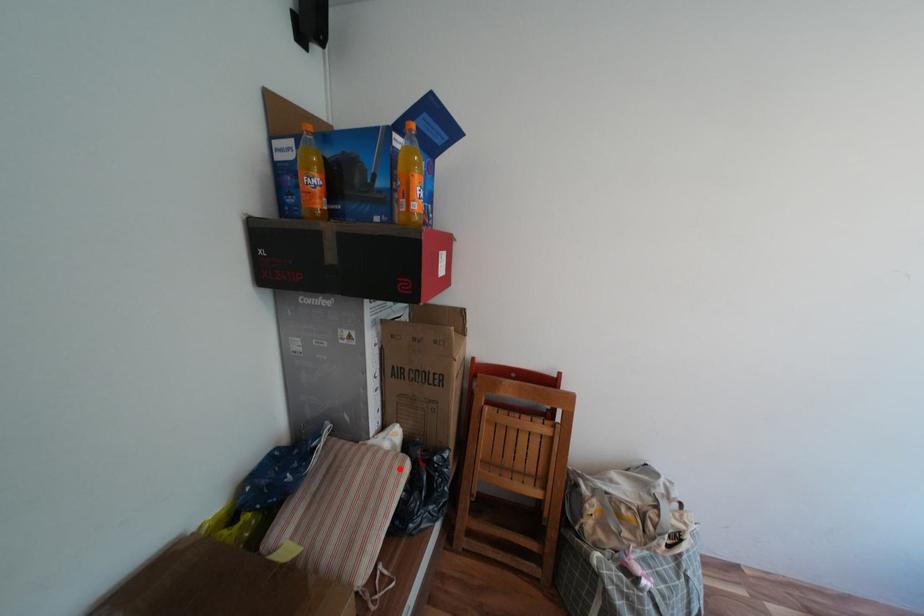
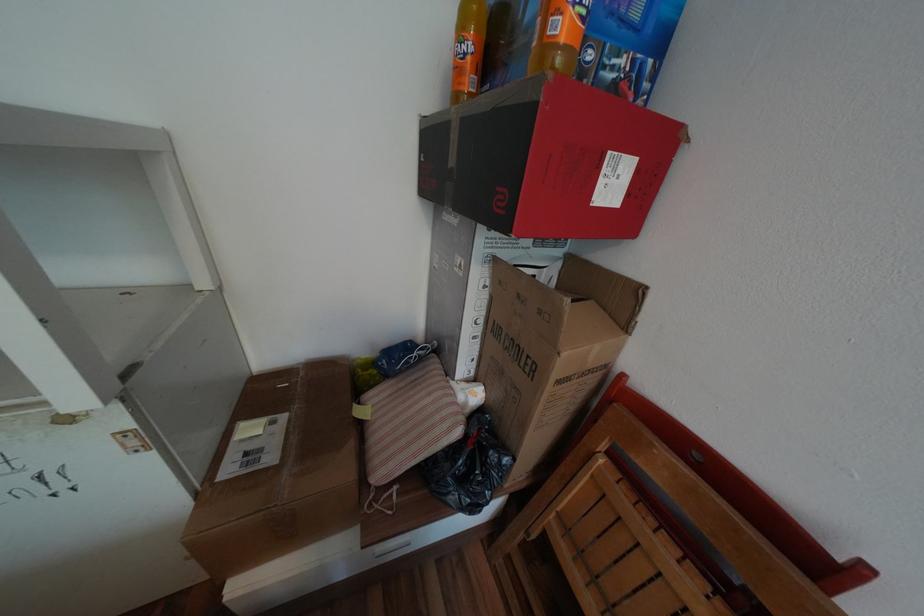
The point at the highlighted location is marked in the first image. Where is the corresponding point in the second image?

(453, 419)